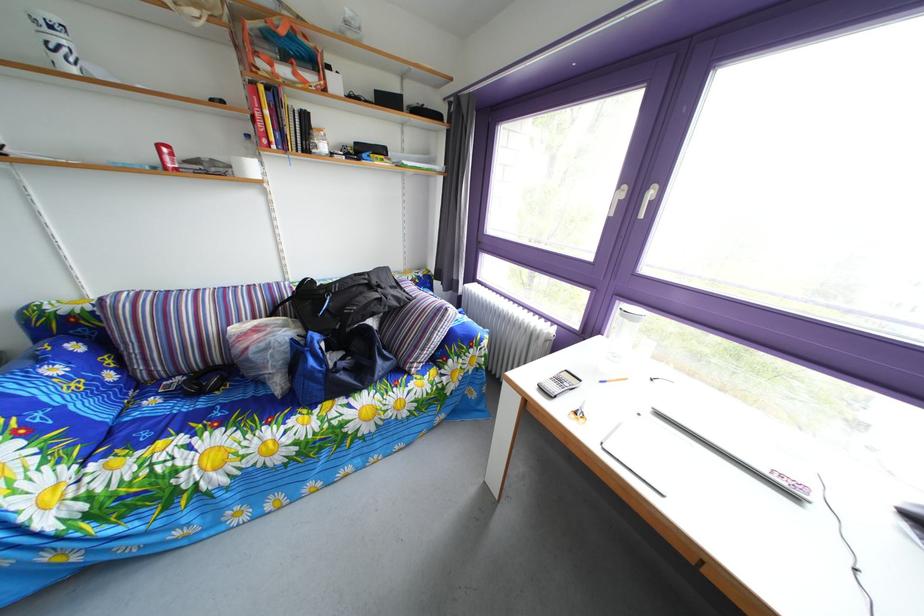
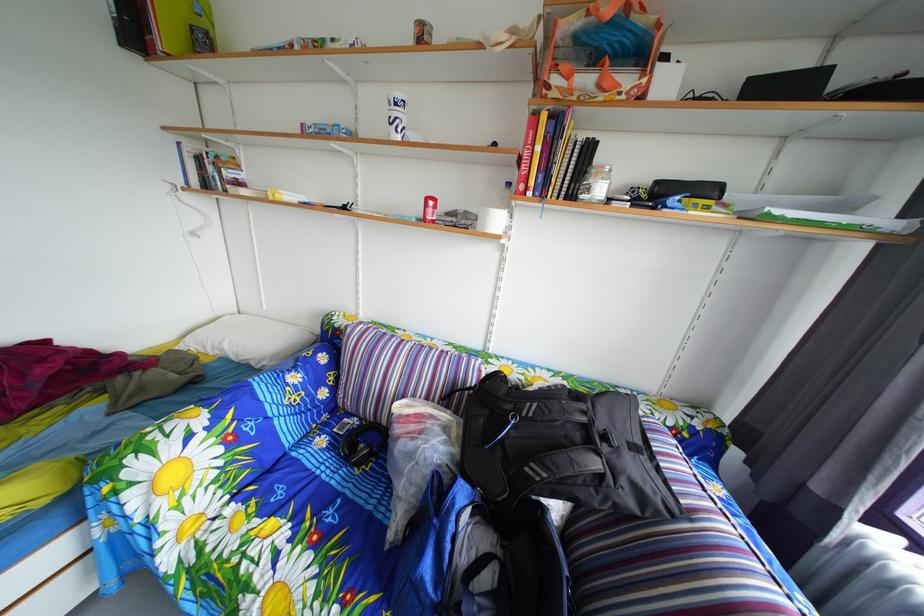
In the second image, find the point that corresponds to [57,38] in the first image.

(404, 116)